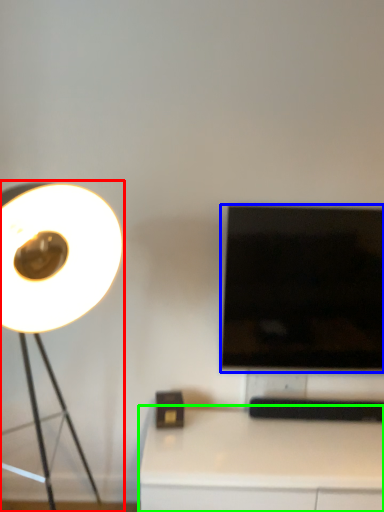
Question: Based on their relative distances, which object is farther from lamp (highlighted by a red box)? Choose from television (highlighted by a blue box) and table (highlighted by a green box).

Choices:
 (A) television
 (B) table

Answer: (B)